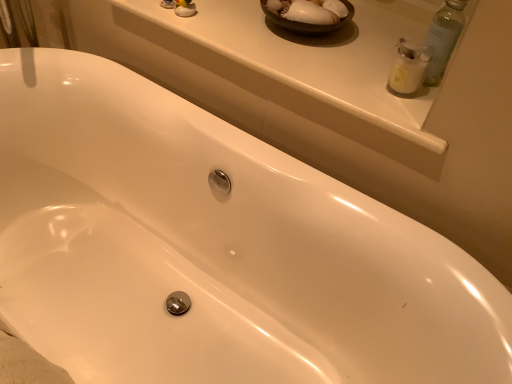
Question: Considering their positions, is white glossy window sill at upper center located in front of or behind white matte jar at upper right?

Choices:
 (A) behind
 (B) front

Answer: (B)

Question: From the image's perspective, is white glossy window sill at upper center above or below white matte jar at upper right?

Choices:
 (A) above
 (B) below

Answer: (A)

Question: Is point (389, 122) closer or farther from the camera than point (407, 82)?

Choices:
 (A) farther
 (B) closer

Answer: (B)

Question: Is point (396, 87) closer or farther from the camera than point (333, 61)?

Choices:
 (A) closer
 (B) farther

Answer: (A)

Question: Which is correct: white matte jar at upper right is inside white glossy window sill at upper center, or outside of it?

Choices:
 (A) outside
 (B) inside

Answer: (A)

Question: From a real-world perspective, relative to white glossy window sill at upper center, is white matte jar at upper right vertically above or below?

Choices:
 (A) above
 (B) below

Answer: (A)

Question: Is white matte jar at upper right taller or shorter than white glossy window sill at upper center?

Choices:
 (A) short
 (B) tall

Answer: (B)